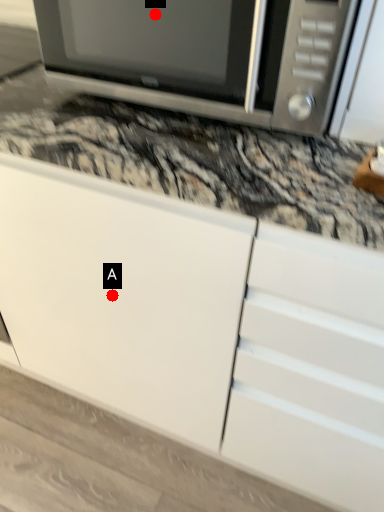
Question: Two points are circled on the image, labeled by A and B beside each circle. Which point is closer to the camera taking this photo?

Choices:
 (A) A is closer
 (B) B is closer

Answer: (B)